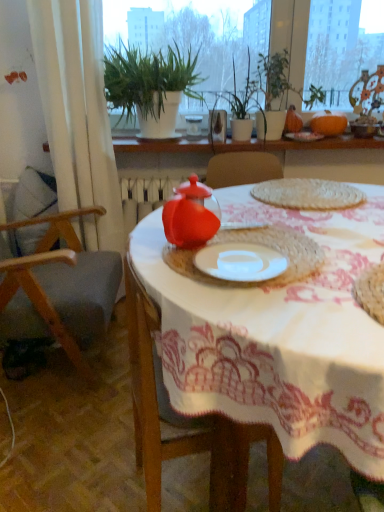
Question: Is there a large distance between woven mat at center and orange matte pumpkin at upper right?

Choices:
 (A) no
 (B) yes

Answer: (A)

Question: From the image's perspective, is woven mat at center located beneath orange matte pumpkin at upper right?

Choices:
 (A) yes
 (B) no

Answer: (A)

Question: From a real-world perspective, is woven mat at center physically below orange matte pumpkin at upper right?

Choices:
 (A) no
 (B) yes

Answer: (B)

Question: Is woven mat at center to the left of orange matte pumpkin at upper right from the viewer's perspective?

Choices:
 (A) yes
 (B) no

Answer: (A)

Question: Is woven mat at center positioned behind orange matte pumpkin at upper right?

Choices:
 (A) no
 (B) yes

Answer: (A)

Question: In terms of size, does green matte plant at upper center appear bigger or smaller than green leafy plants at upper center?

Choices:
 (A) big
 (B) small

Answer: (B)

Question: Is green matte plant at upper center taller or shorter than green leafy plants at upper center?

Choices:
 (A) tall
 (B) short

Answer: (B)

Question: From a real-world perspective, is green matte plant at upper center above or below green leafy plants at upper center?

Choices:
 (A) above
 (B) below

Answer: (B)

Question: Is green matte plant at upper center wider or thinner than green leafy plants at upper center?

Choices:
 (A) thin
 (B) wide

Answer: (B)

Question: Visually, is wooden chair at left positioned to the left or to the right of matte plastic teapot at center, which appears as the second tableware when viewed from the back?

Choices:
 (A) left
 (B) right

Answer: (A)

Question: Does point pyautogui.click(x=13, y=314) appear closer or farther from the camera than point pyautogui.click(x=177, y=212)?

Choices:
 (A) farther
 (B) closer

Answer: (A)

Question: In terms of height, does wooden chair at left look taller or shorter compared to matte plastic teapot at center, acting as the second tableware starting from the top?

Choices:
 (A) tall
 (B) short

Answer: (A)

Question: Considering the positions of wooden chair at left and matte plastic teapot at center, which is counted as the 1th tableware, starting from the left, in the image, is wooden chair at left wider or thinner than matte plastic teapot at center, which is counted as the 1th tableware, starting from the left,?

Choices:
 (A) wide
 (B) thin

Answer: (A)

Question: From the image's perspective, relative to green leafy plant at upper center, is white fabric curtain at left above or below?

Choices:
 (A) above
 (B) below

Answer: (B)

Question: Is point (31, 14) positioned closer to the camera than point (152, 95)?

Choices:
 (A) farther
 (B) closer

Answer: (B)